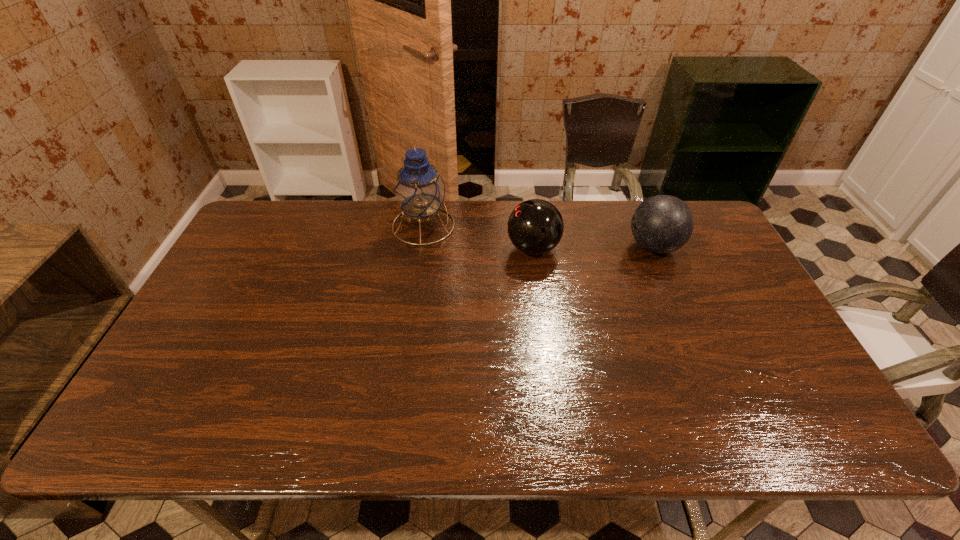
Image resolution: width=960 pixels, height=540 pixels. Find the location of `the leftmost object`. the leftmost object is located at coordinates (419, 190).

You are a GUI agent. You are given a task and a screenshot of the screen. Output one action in this format:
    pyautogui.click(x=<x>, y=<y>)
    Task: Click on the tallest object
    The width and height of the screenshot is (960, 540).
    Given the screenshot: What is the action you would take?
    (x=419, y=190)

I want to click on the right bowling ball, so click(661, 224).

Find the location of a particular element. the second object from right to left is located at coordinates (535, 226).

Where is `vacant space situated 0.140m on the front-facing side of the leftmost object`? vacant space situated 0.140m on the front-facing side of the leftmost object is located at coordinates (496, 225).

Identify the location of free space located on the grip area of the right bowling ball. This screenshot has height=540, width=960. (x=582, y=247).

The width and height of the screenshot is (960, 540). I want to click on blank space located 0.110m on the grip area of the right bowling ball, so click(x=591, y=247).

Where is `free space located 0.250m on the grip area of the right bowling ball`? This screenshot has width=960, height=540. free space located 0.250m on the grip area of the right bowling ball is located at coordinates (548, 247).

Where is `free space located 0.340m on the surface of the second object from left to right near the finger holes`? The width and height of the screenshot is (960, 540). free space located 0.340m on the surface of the second object from left to right near the finger holes is located at coordinates (400, 248).

You are a GUI agent. You are given a task and a screenshot of the screen. Output one action in this format:
    pyautogui.click(x=<x>, y=<y>)
    Task: Click on the free space located 0.220m on the surface of the second object from left to right near the finger holes
    The height and width of the screenshot is (540, 960).
    Given the screenshot: What is the action you would take?
    pyautogui.click(x=438, y=248)